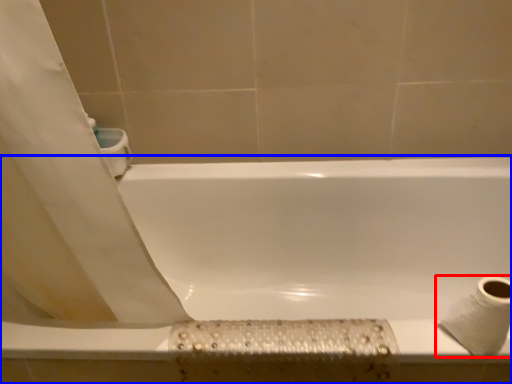
Question: Among these objects, which one is nearest to the camera, toilet paper (highlighted by a red box) or bathtub (highlighted by a blue box)?

Choices:
 (A) toilet paper
 (B) bathtub

Answer: (A)